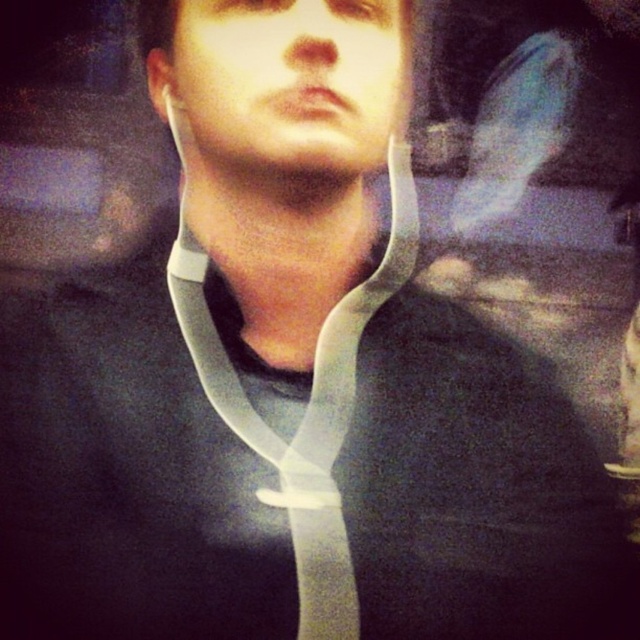
You are a medical professional examining the image of a patient wearing two plastic items around their neck. The items are the matte plastic neck brace at center and the clear plastic neckband at center. Which one is shorter?

The matte plastic neck brace at center is shorter than the clear plastic neckband at center.

You are a medical professional examining a patient who has two devices on their neck. The devices are a matte plastic neck brace at center and a clear plastic neckband at center. Which device is located to the left of the other?

The matte plastic neck brace at center is positioned on the left side of clear plastic neckband at center.